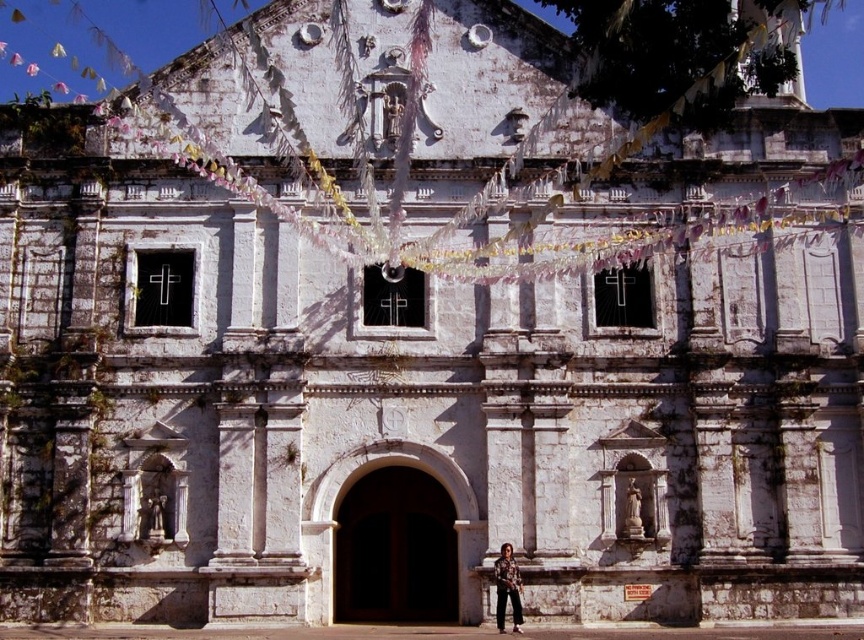
Question: Can you confirm if brown wooden door at center is smaller than camouflage shirt at lower center?

Choices:
 (A) no
 (B) yes

Answer: (A)

Question: Can you confirm if brown wooden door at center is positioned below camouflage shirt at lower center?

Choices:
 (A) yes
 (B) no

Answer: (B)

Question: Which of the following is the farthest from the observer?

Choices:
 (A) brown wooden door at center
 (B) camouflage shirt at lower center

Answer: (A)

Question: Does brown wooden door at center have a greater width compared to camouflage shirt at lower center?

Choices:
 (A) no
 (B) yes

Answer: (B)